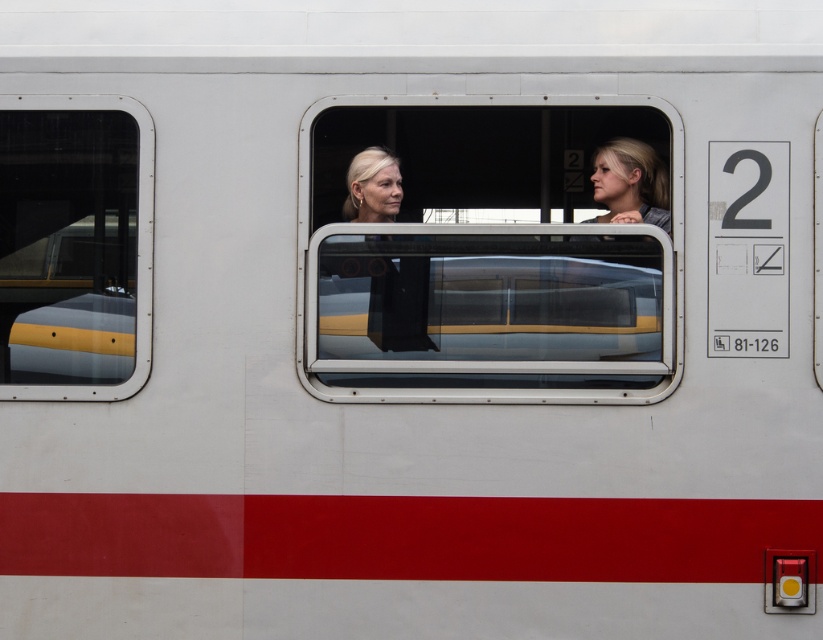
You are a delivery robot inside the train car. You need to move a package from the transparent glass train window at center to the clear glass train window at left. Can you fit the package, which is 60 centimeters wide, between the two windows?

The transparent glass train window at center and clear glass train window at left are 58.46 centimeters apart. Since the package is 60 centimeters wide, it cannot fit between them as the distance is smaller than the package width.

You are a passenger on the train and want to check the outside view through the clear glass train window at left. However, there is a person with matte black hair at center sitting in front of you. Can you see the outside clearly through the window?

The clear glass train window at left is located above the matte black hair at center, so you can see the outside view through the clear glass train window at left as the person with matte black hair at center is sitting below it and not blocking the window.

You are a passenger on the train and want to take a photo of the landscape outside through the window. Since you have a wide lens, you need to know which object is wider between the clear glass train window at left and the smooth blonde hair at center. Which one is wider?

The clear glass train window at left is wider than smooth blonde hair at center according to the description.